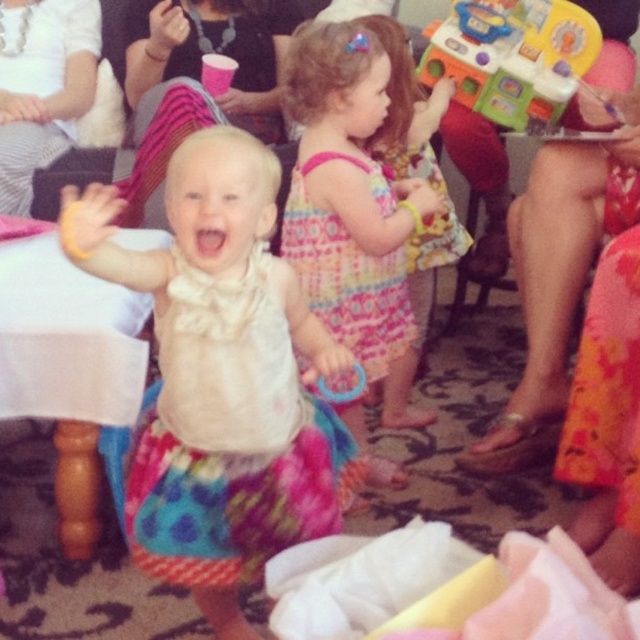
Can you confirm if pastel floral dress at center is bigger than printed cotton dress at center?

Yes, pastel floral dress at center is bigger than printed cotton dress at center.

Can you confirm if pastel floral dress at center is positioned to the right of printed cotton dress at center?

Yes, pastel floral dress at center is to the right of printed cotton dress at center.

Which is in front, point (433, 208) or point (333, 381)?

Point (333, 381)

Image resolution: width=640 pixels, height=640 pixels. In order to click on pastel floral dress at center in this screenshot , I will do `click(348, 195)`.

Is matte white dress at center to the left of printed cotton dress at center from the viewer's perspective?

Yes, matte white dress at center is to the left of printed cotton dress at center.

Which is below, matte white dress at center or printed cotton dress at center?

matte white dress at center is lower down.

Which is behind, point (186, 563) or point (349, 348)?

Positioned behind is point (349, 348).

Locate an element on the screen. matte white dress at center is located at coordinates (221, 372).

From the picture: Between pastel floral dress at center and metallic silver flip-flop at lower right, which one appears on the left side from the viewer's perspective?

From the viewer's perspective, pastel floral dress at center appears more on the left side.

Measure the distance between pastel floral dress at center and metallic silver flip-flop at lower right.

pastel floral dress at center is 17.27 inches away from metallic silver flip-flop at lower right.

Which is in front, point (364, 72) or point (561, 374)?

Point (364, 72)

The height and width of the screenshot is (640, 640). In order to click on pastel floral dress at center in this screenshot , I will do `click(348, 195)`.